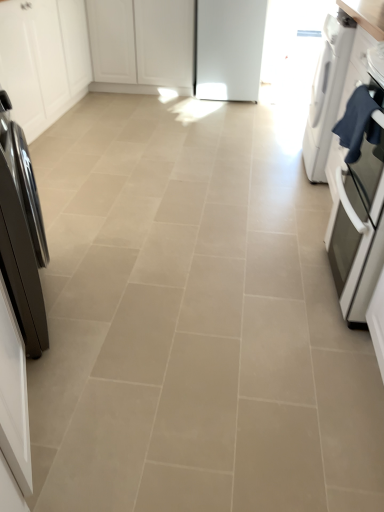
Identify the location of free space that is in between white glossy dryer at right, arranged as the second home appliance when ordered from the bottom, and shiny black refrigerator at left, which is the second home appliance from back to front. This screenshot has height=512, width=384. (195, 225).